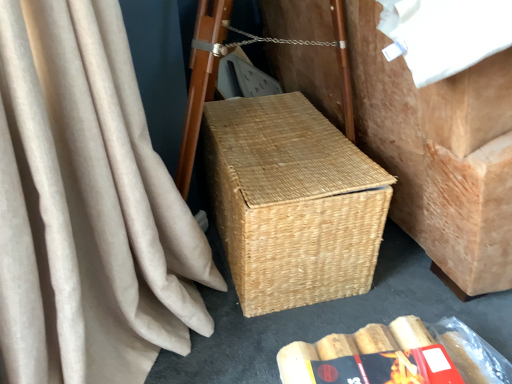
Question: Can you confirm if red matte paperback book at lower center is thinner than natural woven picnic basket at center?

Choices:
 (A) yes
 (B) no

Answer: (A)

Question: Is red matte paperback book at lower center at the left side of natural woven picnic basket at center?

Choices:
 (A) yes
 (B) no

Answer: (B)

Question: Considering the relative sizes of red matte paperback book at lower center and natural woven picnic basket at center in the image provided, is red matte paperback book at lower center taller than natural woven picnic basket at center?

Choices:
 (A) yes
 (B) no

Answer: (B)

Question: Can you confirm if red matte paperback book at lower center is wider than natural woven picnic basket at center?

Choices:
 (A) no
 (B) yes

Answer: (A)

Question: From the image's perspective, does red matte paperback book at lower center appear higher than natural woven picnic basket at center?

Choices:
 (A) yes
 (B) no

Answer: (B)

Question: Could you tell me if red matte paperback book at lower center is facing natural woven picnic basket at center?

Choices:
 (A) no
 (B) yes

Answer: (A)

Question: From a real-world perspective, is red matte paperback book at lower center under woven brown basket at center?

Choices:
 (A) yes
 (B) no

Answer: (B)

Question: Does red matte paperback book at lower center appear on the right side of woven brown basket at center?

Choices:
 (A) yes
 (B) no

Answer: (B)

Question: Can you confirm if red matte paperback book at lower center is thinner than woven brown basket at center?

Choices:
 (A) no
 (B) yes

Answer: (B)

Question: Does red matte paperback book at lower center have a larger size compared to woven brown basket at center?

Choices:
 (A) no
 (B) yes

Answer: (A)

Question: Can you see red matte paperback book at lower center touching woven brown basket at center?

Choices:
 (A) no
 (B) yes

Answer: (B)

Question: Can you confirm if red matte paperback book at lower center is wider than woven brown basket at center?

Choices:
 (A) no
 (B) yes

Answer: (A)

Question: Is natural woven basket at center facing towards natural woven picnic basket at center?

Choices:
 (A) yes
 (B) no

Answer: (B)